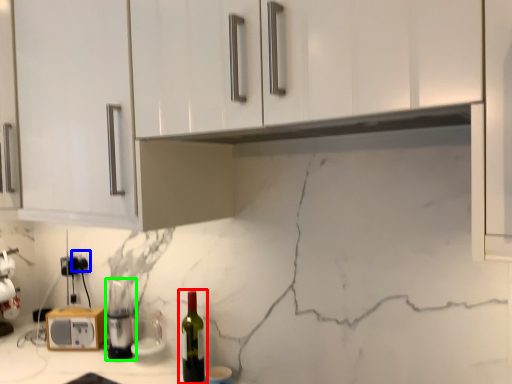
Question: Which is farther away from bottle (highlighted by a red box)? electric outlet (highlighted by a blue box) or appliance (highlighted by a green box)?

Choices:
 (A) electric outlet
 (B) appliance

Answer: (A)